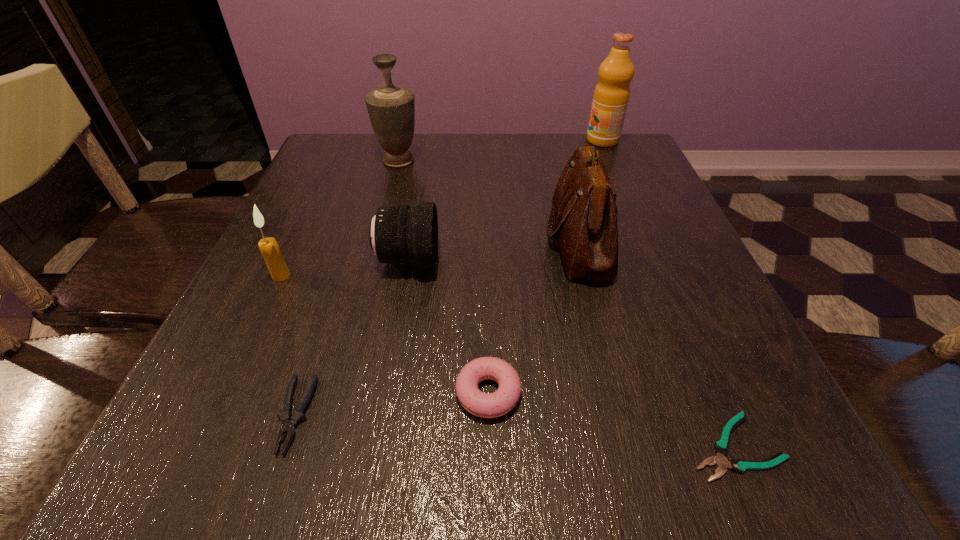
At what (x,y) coordinates should I click in order to perform the action: click on object identified as the closest to the shorter pliers. Please return your answer as a coordinate pair (x, y). This screenshot has width=960, height=540. Looking at the image, I should click on (486, 405).

The height and width of the screenshot is (540, 960). In order to click on free space that satisfies the following two spatial constraints: 1. on the front label of the right pliers; 2. on the right side of the fruit juice in this screenshot , I will do `click(732, 447)`.

Identify the location of free location that satisfies the following two spatial constraints: 1. at the front element of the telephoto lens; 2. on the right side of the fifth object from left to right. (385, 393).

You are a GUI agent. You are given a task and a screenshot of the screen. Output one action in this format:
    pyautogui.click(x=<x>, y=<y>)
    Task: Click on the free space that satisfies the following two spatial constraints: 1. at the front element of the telephoto lens; 2. on the front side of the leftmost object
    
    Given the screenshot: What is the action you would take?
    pyautogui.click(x=405, y=275)

Find the location of a particular element. This screenshot has width=960, height=540. free location that satisfies the following two spatial constraints: 1. on the front label of the fruit juice; 2. on the front side of the sixth tallest object is located at coordinates (708, 393).